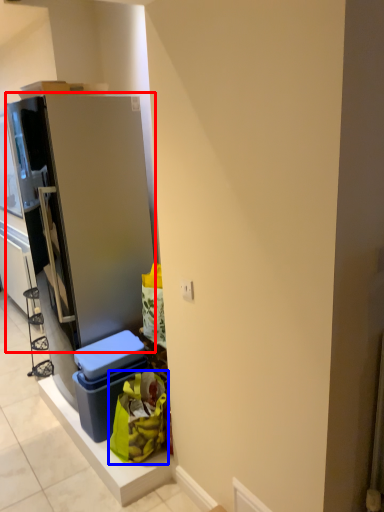
Question: Among these objects, which one is nearest to the camera, refrigerator (highlighted by a red box) or garbage (highlighted by a blue box)?

Choices:
 (A) refrigerator
 (B) garbage

Answer: (B)